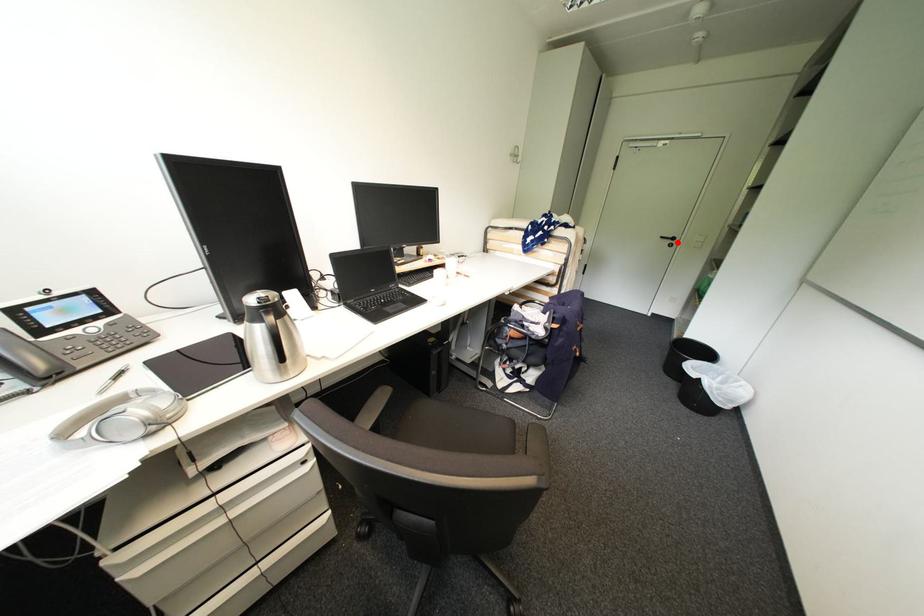
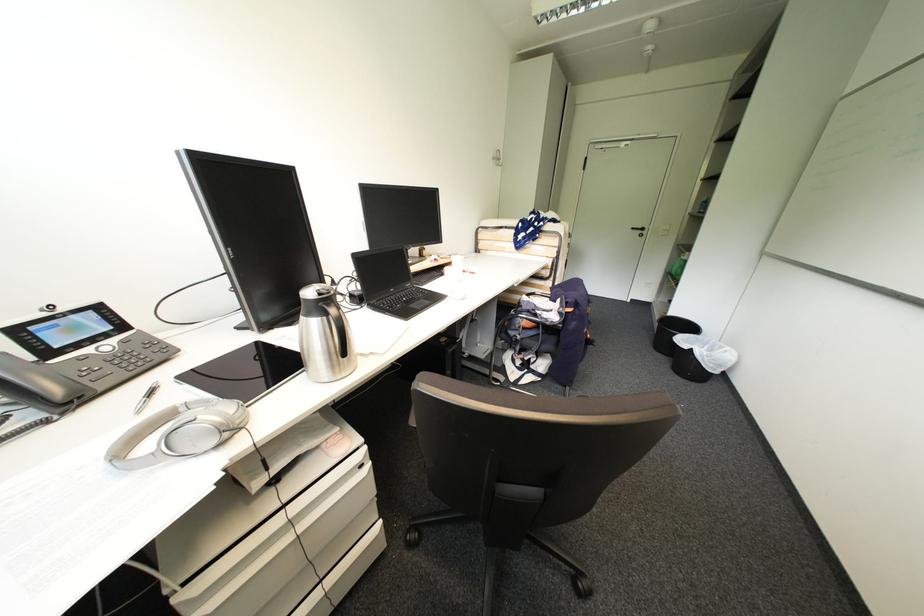
The point at the highlighted location is marked in the first image. Where is the corresponding point in the second image?

(648, 233)